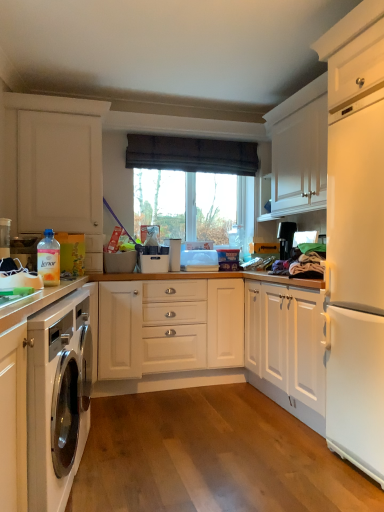
Where is `black plastic coffee maker at upper right`? The image size is (384, 512). black plastic coffee maker at upper right is located at coordinates (286, 238).

What do you see at coordinates (25, 362) in the screenshot?
I see `white glossy cabinet at lower left, which ranks as the 2th cabinetry in top-to-bottom order` at bounding box center [25, 362].

Find the location of a particular element. translucent plastic bottle at lower left is located at coordinates (49, 259).

From the image's perspective, relative to dark brown fabric at upper center, is transparent glass window at center above or below?

Clearly, from the image's perspective, transparent glass window at center is below dark brown fabric at upper center.

Is dark brown fabric at upper center a part of transparent glass window at center?

No.

From a real-world perspective, between transparent glass window at center and dark brown fabric at upper center, who is vertically higher?

From a 3D spatial view, dark brown fabric at upper center is above.

Does point (193, 168) appear closer or farther from the camera than point (136, 147)?

Point (193, 168) is farther from the camera than point (136, 147).

Is translucent plastic bottle at lower left beside dark brown fabric at upper center?

No, translucent plastic bottle at lower left is not with dark brown fabric at upper center.

In the image, is translucent plastic bottle at lower left positioned in front of or behind dark brown fabric at upper center?

translucent plastic bottle at lower left is positioned closer to the viewer than dark brown fabric at upper center.

Based on the photo, does translucent plastic bottle at lower left have a lesser width compared to dark brown fabric at upper center?

Correct, the width of translucent plastic bottle at lower left is less than that of dark brown fabric at upper center.

Is translucent plastic bottle at lower left oriented towards dark brown fabric at upper center?

No, translucent plastic bottle at lower left is not facing towards dark brown fabric at upper center.

Would you say translucent plastic bottle at lower left contains black plastic coffee maker at upper right?

Actually, black plastic coffee maker at upper right is outside translucent plastic bottle at lower left.

Is point (42, 243) positioned behind point (291, 239)?

No, (42, 243) is in front of (291, 239).

From a real-world perspective, which is physically above, translucent plastic bottle at lower left or black plastic coffee maker at upper right?

In real-world perspective, black plastic coffee maker at upper right is above.

How many degrees apart are the facing directions of translucent plastic bottle at lower left and black plastic coffee maker at upper right?

The facing directions of translucent plastic bottle at lower left and black plastic coffee maker at upper right are 82 degrees apart.

Can you confirm if black plastic coffee maker at upper right is smaller than dark brown fabric at upper center?

Correct, black plastic coffee maker at upper right occupies less space than dark brown fabric at upper center.

Is black plastic coffee maker at upper right oriented away from dark brown fabric at upper center?

black plastic coffee maker at upper right does not have its back to dark brown fabric at upper center.

Is white glossy cabinet at lower left, which ranks as the 2th cabinetry in top-to-bottom order, oriented towards translucent plastic bottle at lower left?

No, white glossy cabinet at lower left, which ranks as the 2th cabinetry in top-to-bottom order, does not turn towards translucent plastic bottle at lower left.

Looking at this image, between white glossy cabinet at lower left, positioned as the first cabinetry in bottom-to-top order, and translucent plastic bottle at lower left, which one has larger size?

With larger size is white glossy cabinet at lower left, positioned as the first cabinetry in bottom-to-top order.

Can you confirm if white glossy cabinet at lower left, which ranks as the 2th cabinetry in top-to-bottom order, is shorter than translucent plastic bottle at lower left?

No, white glossy cabinet at lower left, which ranks as the 2th cabinetry in top-to-bottom order, is not shorter than translucent plastic bottle at lower left.

Based on the photo, is the depth of white glossy cabinet at lower left, which is the 1th cabinetry from front to back, greater than that of translucent plastic bottle at lower left?

No, the depth of white glossy cabinet at lower left, which is the 1th cabinetry from front to back, is less than that of translucent plastic bottle at lower left.

Does point (21, 160) come behind point (41, 239)?

Yes, point (21, 160) is farther from viewer.

Is white matte cabinet at left, the second cabinetry when ordered from bottom to top, further to the viewer compared to translucent plastic bottle at lower left?

Yes, white matte cabinet at left, the second cabinetry when ordered from bottom to top, is further from the camera.

Does white matte cabinet at left, marked as the 1th cabinetry in a back-to-front arrangement, have a greater width compared to translucent plastic bottle at lower left?

Indeed, white matte cabinet at left, marked as the 1th cabinetry in a back-to-front arrangement, has a greater width compared to translucent plastic bottle at lower left.

Is white glossy cabinet at lower left, the second cabinetry viewed from the back, positioned with its back to white matte cabinet at left, the second cabinetry when ordered from bottom to top?

No, white glossy cabinet at lower left, the second cabinetry viewed from the back, is not facing away from white matte cabinet at left, the second cabinetry when ordered from bottom to top.

Which is in front, white glossy cabinet at lower left, which is the 1th cabinetry from front to back, or white matte cabinet at left, the second cabinetry when ordered from bottom to top?

white glossy cabinet at lower left, which is the 1th cabinetry from front to back, is closer to the camera.

From a real-world perspective, is white glossy cabinet at lower left, which is the 1th cabinetry from front to back, located beneath white matte cabinet at left, positioned as the 2th cabinetry in front-to-back order?

Yes, from a real-world perspective, white glossy cabinet at lower left, which is the 1th cabinetry from front to back, is under white matte cabinet at left, positioned as the 2th cabinetry in front-to-back order.

Considering the sizes of white glossy cabinet at lower left, which is the 1th cabinetry from front to back, and white matte cabinet at left, marked as the 1th cabinetry in a back-to-front arrangement, in the image, is white glossy cabinet at lower left, which is the 1th cabinetry from front to back, wider or thinner than white matte cabinet at left, marked as the 1th cabinetry in a back-to-front arrangement,?

Clearly, white glossy cabinet at lower left, which is the 1th cabinetry from front to back, has less width compared to white matte cabinet at left, marked as the 1th cabinetry in a back-to-front arrangement.

This screenshot has width=384, height=512. What are the coordinates of `curtain above the transparent glass window at center (from the image's perspective)` in the screenshot? It's located at (191, 154).

I want to click on bottle below the dark brown fabric at upper center (from the image's perspective), so click(49, 259).

Estimate the real-world distances between objects in this image. Which object is closer to black plastic coffee maker at upper right, translucent plastic bottle at lower left or transparent glass window at center?

transparent glass window at center.

Which object lies further to the anchor point white matte cabinet at left, the second cabinetry when ordered from bottom to top, black plastic coffee maker at upper right or translucent plastic bottle at lower left?

black plastic coffee maker at upper right is positioned further to the anchor white matte cabinet at left, the second cabinetry when ordered from bottom to top.

Considering their positions, is white matte cabinet at left, the second cabinetry when ordered from bottom to top, positioned closer to white glossy cabinet at lower left, positioned as the first cabinetry in bottom-to-top order, than black plastic coffee maker at upper right?

white matte cabinet at left, the second cabinetry when ordered from bottom to top, is positioned closer to the anchor white glossy cabinet at lower left, positioned as the first cabinetry in bottom-to-top order.

When comparing their distances from black plastic coffee maker at upper right, does dark brown fabric at upper center or white glossy cabinet at lower left, positioned as the first cabinetry in bottom-to-top order, seem closer?

dark brown fabric at upper center is closer to black plastic coffee maker at upper right.

From the image, which object appears to be nearer to translucent plastic bottle at lower left, transparent glass window at center or black plastic coffee maker at upper right?

Based on the image, black plastic coffee maker at upper right appears to be nearer to translucent plastic bottle at lower left.

Looking at the image, which one is located further to translucent plastic bottle at lower left, dark brown fabric at upper center or white glossy cabinet at lower left, which is the 1th cabinetry from front to back?

Among the two, dark brown fabric at upper center is located further to translucent plastic bottle at lower left.

Looking at the image, which one is located closer to translucent plastic bottle at lower left, white matte cabinet at left, marked as the 1th cabinetry in a back-to-front arrangement, or transparent glass window at center?

white matte cabinet at left, marked as the 1th cabinetry in a back-to-front arrangement, lies closer to translucent plastic bottle at lower left than the other object.

Considering their positions, is white glossy cabinet at lower left, which is the 1th cabinetry from front to back, positioned closer to transparent glass window at center than black plastic coffee maker at upper right?

black plastic coffee maker at upper right is closer to transparent glass window at center.

In order to click on cabinetry positioned between white glossy cabinet at lower left, positioned as the first cabinetry in bottom-to-top order, and transparent glass window at center from near to far in this screenshot , I will do `click(53, 163)`.

You are a GUI agent. You are given a task and a screenshot of the screen. Output one action in this format:
    pyautogui.click(x=<x>, y=<y>)
    Task: Click on the cabinetry between translucent plastic bottle at lower left and transparent glass window at center from front to back
    
    Given the screenshot: What is the action you would take?
    pyautogui.click(x=53, y=163)

Where is `window between white matte cabinet at left, the second cabinetry when ordered from bottom to top, and dark brown fabric at upper center`? Image resolution: width=384 pixels, height=512 pixels. window between white matte cabinet at left, the second cabinetry when ordered from bottom to top, and dark brown fabric at upper center is located at coordinates (191, 154).

In order to click on curtain positioned between white glossy cabinet at lower left, the second cabinetry viewed from the back, and black plastic coffee maker at upper right from near to far in this screenshot , I will do `click(191, 154)`.